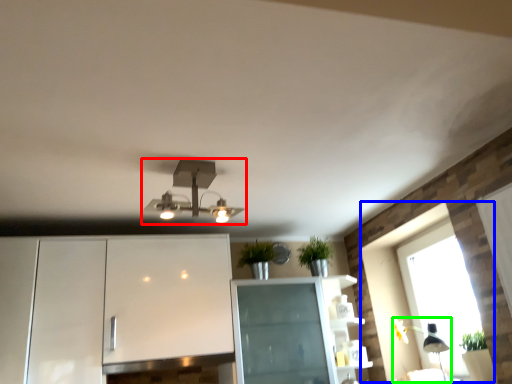
Question: Based on their relative distances, which object is nearer to lamp (highlighted by a red box)? Choose from window (highlighted by a blue box) and light fixture (highlighted by a green box).

Choices:
 (A) window
 (B) light fixture

Answer: (A)